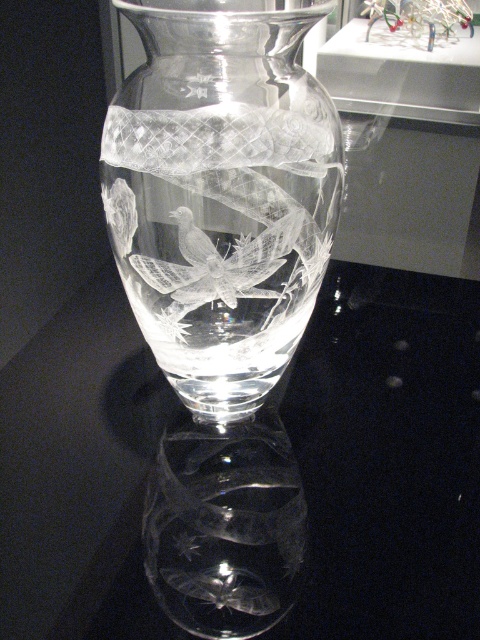
Does transparent glass vase at center have a greater height compared to clear crystal vase at center?

In fact, transparent glass vase at center may be shorter than clear crystal vase at center.

Does transparent glass vase at center have a lesser width compared to clear crystal vase at center?

No.

Where is `transparent glass vase at center`? The height and width of the screenshot is (640, 480). transparent glass vase at center is located at coordinates (388, 456).

Image resolution: width=480 pixels, height=640 pixels. What are the coordinates of `transparent glass vase at center` in the screenshot? It's located at (388, 456).